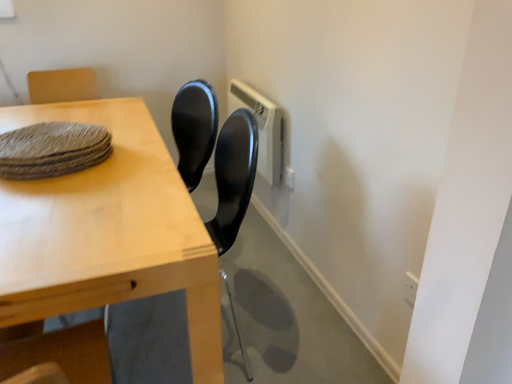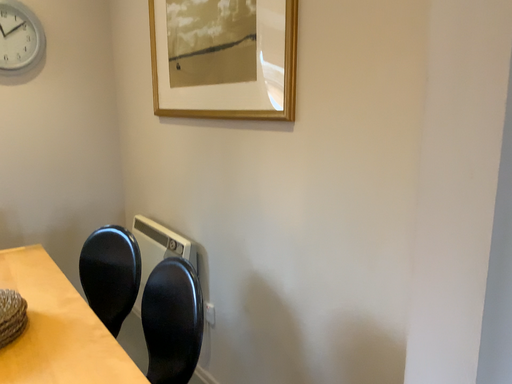
Question: How did the camera likely rotate when shooting the video?

Choices:
 (A) rotated upward
 (B) rotated downward

Answer: (A)